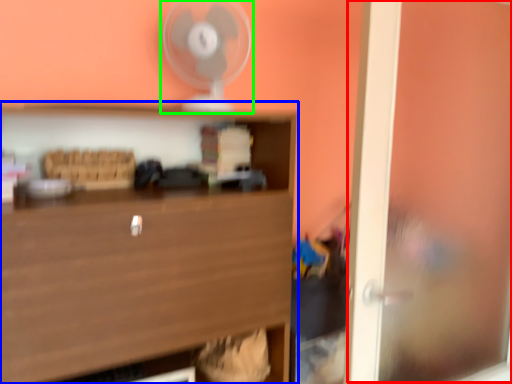
Question: Which object is positioned closest to window (highlighted by a red box)? Select from shelf (highlighted by a blue box) and fan (highlighted by a green box).

Choices:
 (A) shelf
 (B) fan

Answer: (A)